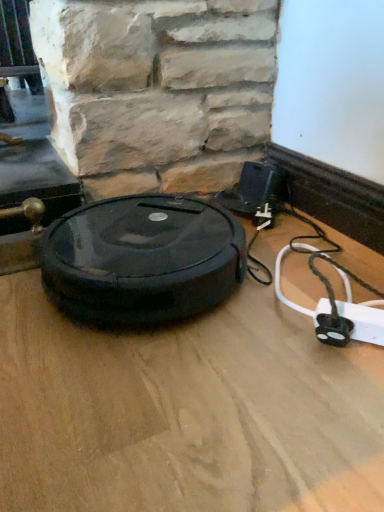
What are the coordinates of `free space in front of black rubber robot vacuum cleaner at center` in the screenshot? It's located at (169, 399).